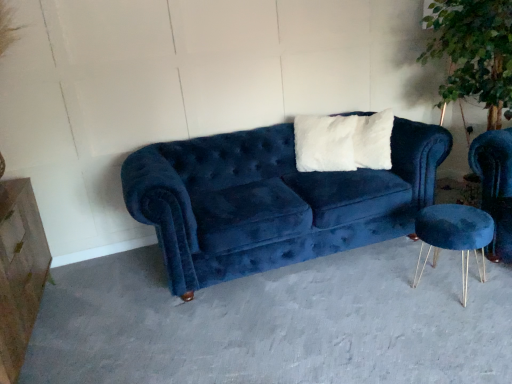
What is the approximate height of white fluffy pillow at center?

white fluffy pillow at center is 18.95 inches tall.

What do you see at coordinates (474, 52) in the screenshot?
I see `green leafy plant at upper right` at bounding box center [474, 52].

Locate an element on the screen. This screenshot has width=512, height=384. velvet blue couch at center is located at coordinates (275, 323).

In order to face velvet blue couch at center, should I rotate leftwards or rightwards?

You should rotate right by 10.549 degrees.

You are a GUI agent. You are given a task and a screenshot of the screen. Output one action in this format:
    pyautogui.click(x=<x>, y=<y>)
    Task: Click on the marble/stone dresser at left
    This screenshot has height=384, width=512.
    Given the screenshot: What is the action you would take?
    pyautogui.click(x=19, y=272)

Identify the location of white fluffy pillow at center. click(373, 140).

From the image's perspective, is velvet blue couch at center located above marble/stone dresser at left?

Actually, velvet blue couch at center appears below marble/stone dresser at left in the image.

The height and width of the screenshot is (384, 512). Find the location of `concrete on the right of marble/stone dresser at left`. concrete on the right of marble/stone dresser at left is located at coordinates (275, 323).

Considering the relative sizes of velvet blue couch at center and marble/stone dresser at left in the image provided, is velvet blue couch at center taller than marble/stone dresser at left?

Incorrect, the height of velvet blue couch at center is not larger of that of marble/stone dresser at left.

Is velvet blue couch at center surrounded by white fluffy pillow at center?

No.

Between white fluffy pillow at center and velvet blue couch at center, which one has more height?

With more height is white fluffy pillow at center.

Looking at this image, is white fluffy pillow at center looking in the opposite direction of velvet blue couch at center?

No.

Considering the positions of point (370, 141) and point (246, 310), is point (370, 141) closer or farther from the camera than point (246, 310)?

Point (370, 141) is positioned farther from the camera compared to point (246, 310).

Considering the sizes of objects white fluffy pillow at center and velvet blue stool at lower right in the image provided, who is taller, white fluffy pillow at center or velvet blue stool at lower right?

With more height is white fluffy pillow at center.

Between white fluffy pillow at center and velvet blue stool at lower right, which one is positioned behind?

white fluffy pillow at center is further away from the camera.

Is white fluffy pillow at center with velvet blue stool at lower right?

No, white fluffy pillow at center is not making contact with velvet blue stool at lower right.

Where is `studio couch located above the marble/stone dresser at left (from the image's perspective)`? This screenshot has width=512, height=384. studio couch located above the marble/stone dresser at left (from the image's perspective) is located at coordinates (272, 200).

Can you confirm if marble/stone dresser at left is shorter than velvet blue couch at center?

Indeed, marble/stone dresser at left has a lesser height compared to velvet blue couch at center.

Does marble/stone dresser at left have a lesser width compared to velvet blue couch at center?

Indeed, marble/stone dresser at left has a lesser width compared to velvet blue couch at center.

Based on their positions, is green leafy plant at upper right located to the left or right of velvet blue couch at center?

green leafy plant at upper right is to the right of velvet blue couch at center.

Is green leafy plant at upper right beside velvet blue couch at center?

green leafy plant at upper right and velvet blue couch at center are clearly separated.

Considering the relative sizes of green leafy plant at upper right and velvet blue couch at center in the image provided, is green leafy plant at upper right thinner than velvet blue couch at center?

Yes.

Is point (440, 7) farther from viewer compared to point (492, 354)?

Yes.

From the picture: From the image's perspective, relative to marble/stone dresser at left, is white fluffy pillow at center above or below?

white fluffy pillow at center is above marble/stone dresser at left.

Does white fluffy pillow at center have a lesser width compared to marble/stone dresser at left?

Yes, white fluffy pillow at center is thinner than marble/stone dresser at left.

In the image, is white fluffy pillow at center on the left side or the right side of marble/stone dresser at left?

white fluffy pillow at center is to the right of marble/stone dresser at left.

Is white fluffy pillow at center positioned with its back to marble/stone dresser at left?

No, marble/stone dresser at left is not at the back of white fluffy pillow at center.

Considering the sizes of objects white fluffy pillow at center and green leafy plant at upper right in the image provided, who is taller, white fluffy pillow at center or green leafy plant at upper right?

green leafy plant at upper right is taller.

Is white fluffy pillow at center further to the viewer compared to green leafy plant at upper right?

No.

Can you confirm if white fluffy pillow at center is wider than green leafy plant at upper right?

Incorrect, the width of white fluffy pillow at center does not surpass that of green leafy plant at upper right.

Is white fluffy pillow at center beside green leafy plant at upper right?

white fluffy pillow at center and green leafy plant at upper right are clearly separated.

Locate an element on the screen. dresser to the left of velvet blue couch at center is located at coordinates (19, 272).

This screenshot has height=384, width=512. I want to click on pillow that is above the velvet blue couch at center (from a real-world perspective), so click(x=373, y=140).

Based on their spatial positions, is white fluffy pillow at center or green leafy plant at upper right further from velvet blue couch at center?

green leafy plant at upper right lies further to velvet blue couch at center than the other object.

Looking at the image, which one is located further to velvet blue couch at center, velvet blue stool at lower right or marble/stone dresser at left?

marble/stone dresser at left.

Estimate the real-world distances between objects in this image. Which object is closer to green leafy plant at upper right, velvet blue couch at center or white fluffy pillow at center?

white fluffy pillow at center is positioned closer to the anchor green leafy plant at upper right.

From the image, which object appears to be nearer to green leafy plant at upper right, white fluffy pillow at center or velvet blue stool at lower right?

Based on the image, white fluffy pillow at center appears to be nearer to green leafy plant at upper right.

Considering their positions, is velvet blue couch at center positioned further to white fluffy pillow at center than velvet blue stool at lower right?

velvet blue stool at lower right lies further to white fluffy pillow at center than the other object.

When comparing their distances from marble/stone dresser at left, does green leafy plant at upper right or velvet blue stool at lower right seem further?

The object further to marble/stone dresser at left is green leafy plant at upper right.

Estimate the real-world distances between objects in this image. Which object is closer to velvet blue stool at lower right, velvet blue couch at center or white fluffy pillow at center?

white fluffy pillow at center is positioned closer to the anchor velvet blue stool at lower right.

Which object lies nearer to the anchor point green leafy plant at upper right, velvet blue couch at center or marble/stone dresser at left?

Among the two, velvet blue couch at center is located nearer to green leafy plant at upper right.

At what (x,y) coordinates should I click in order to perform the action: click on concrete between marble/stone dresser at left and velvet blue stool at lower right. Please return your answer as a coordinate pair (x, y). The width and height of the screenshot is (512, 384). Looking at the image, I should click on (x=275, y=323).

Identify the location of bar stool located between velvet blue couch at center and green leafy plant at upper right in the left-right direction. (454, 236).

At what (x,y) coordinates should I click in order to perform the action: click on bar stool between velvet blue couch at center and green leafy plant at upper right from front to back. Please return your answer as a coordinate pair (x, y). The image size is (512, 384). Looking at the image, I should click on (454, 236).

Locate an element on the screen. The image size is (512, 384). pillow between velvet blue couch at center and green leafy plant at upper right along the z-axis is located at coordinates (373, 140).